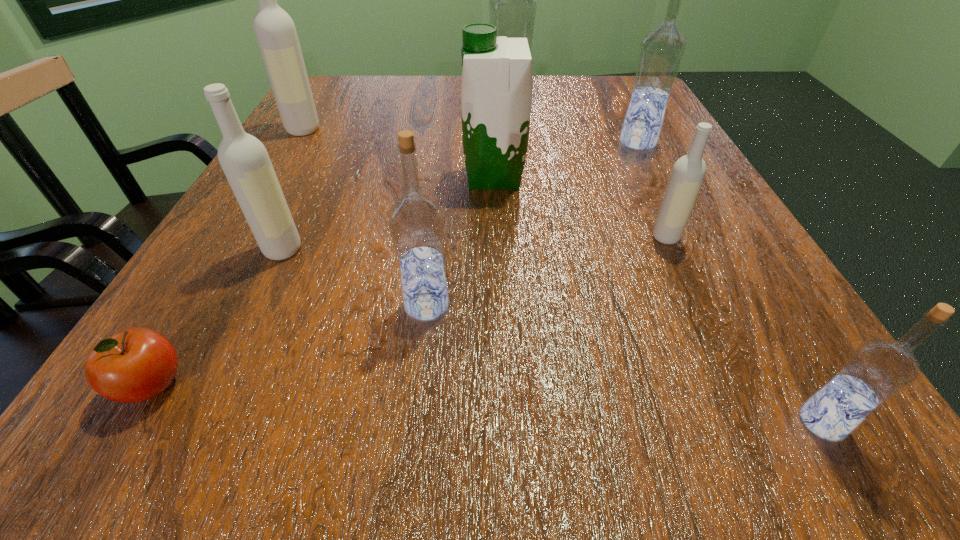
Find the location of a particular element. object at the near left corner is located at coordinates (137, 364).

Identify the location of object present at the near right corner. (877, 370).

I want to click on blank space at the far edge, so click(x=580, y=97).

Where is `vacant space at the left edge`? The height and width of the screenshot is (540, 960). vacant space at the left edge is located at coordinates (195, 291).

Locate an element on the screen. free space at the right edge is located at coordinates (611, 164).

Image resolution: width=960 pixels, height=540 pixels. In the image, there is a desktop. Find the location of `vacant space at the far left corner`. vacant space at the far left corner is located at coordinates (321, 77).

Where is `vacant space at the near left corner`? The height and width of the screenshot is (540, 960). vacant space at the near left corner is located at coordinates (192, 437).

Find the location of a particular element. The width and height of the screenshot is (960, 540). vacant space at the far right corner is located at coordinates (589, 86).

The height and width of the screenshot is (540, 960). I want to click on free area in between the third smallest blue vodka and the second smallest white vodka, so click(460, 196).

This screenshot has height=540, width=960. I want to click on vacant area between the second biggest blue vodka and the soya milk, so click(566, 160).